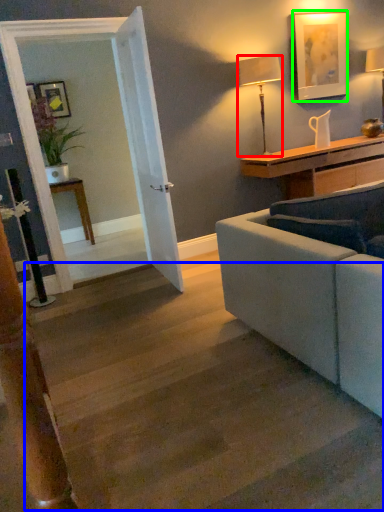
Question: Which object is positioned farthest from lamp (highlighted by a red box)? Select from stairwell (highlighted by a blue box) and picture frame (highlighted by a green box).

Choices:
 (A) stairwell
 (B) picture frame

Answer: (A)